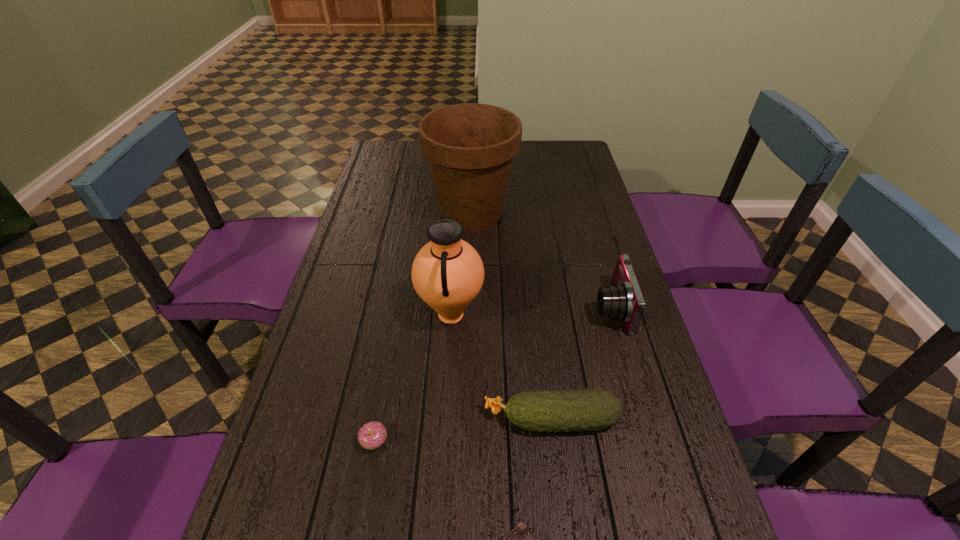
Select which object appears as the closest to the nearest object. Please provide its 2D coordinates. Your answer should be formatted as a tuple, i.e. [(x, y)], where the tuple contains the x and y coordinates of a point satisfying the conditions above.

[(593, 409)]

Select which object is the second closest to the flowerpot. Please provide its 2D coordinates. Your answer should be formatted as a tuple, i.e. [(x, y)], where the tuple contains the x and y coordinates of a point satisfying the conditions above.

[(624, 300)]

Where is `vacant position in the image that satisfies the following two spatial constraints: 1. on the back side of the farthest object; 2. on the left side of the cupcake`? vacant position in the image that satisfies the following two spatial constraints: 1. on the back side of the farthest object; 2. on the left side of the cupcake is located at coordinates (416, 213).